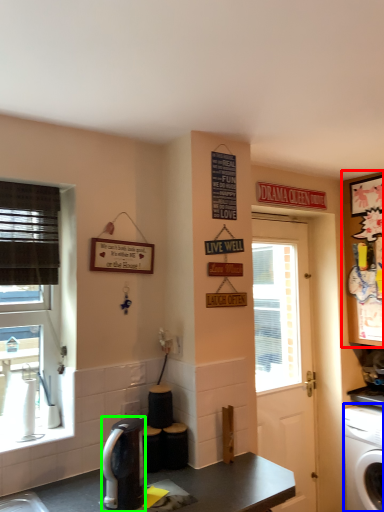
Question: Considering the real-world distances, which object is closest to cabinetry (highlighted by a red box)? washing machine (highlighted by a blue box) or coffee maker (highlighted by a green box).

Choices:
 (A) washing machine
 (B) coffee maker

Answer: (A)